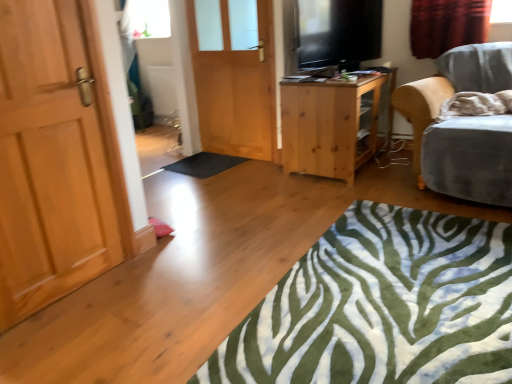
Question: Can you confirm if flat screen tv at upper right is smaller than red velvet curtain at upper right?

Choices:
 (A) yes
 (B) no

Answer: (B)

Question: Can you confirm if flat screen tv at upper right is positioned to the left of red velvet curtain at upper right?

Choices:
 (A) yes
 (B) no

Answer: (A)

Question: Does flat screen tv at upper right have a greater height compared to red velvet curtain at upper right?

Choices:
 (A) yes
 (B) no

Answer: (A)

Question: Considering the relative positions of flat screen tv at upper right and red velvet curtain at upper right in the image provided, is flat screen tv at upper right in front of red velvet curtain at upper right?

Choices:
 (A) no
 (B) yes

Answer: (B)

Question: Is flat screen tv at upper right oriented towards red velvet curtain at upper right?

Choices:
 (A) yes
 (B) no

Answer: (A)

Question: Considering the relative positions of flat screen tv at upper right and red velvet curtain at upper right in the image provided, is flat screen tv at upper right behind red velvet curtain at upper right?

Choices:
 (A) no
 (B) yes

Answer: (A)

Question: From a real-world perspective, is flat screen tv at upper right physically above black rubber mat at center?

Choices:
 (A) no
 (B) yes

Answer: (B)

Question: Could you tell me if flat screen tv at upper right is facing black rubber mat at center?

Choices:
 (A) no
 (B) yes

Answer: (A)

Question: Considering the relative positions of flat screen tv at upper right and black rubber mat at center in the image provided, is flat screen tv at upper right to the right of black rubber mat at center from the viewer's perspective?

Choices:
 (A) yes
 (B) no

Answer: (A)

Question: Is black rubber mat at center surrounded by flat screen tv at upper right?

Choices:
 (A) yes
 (B) no

Answer: (B)

Question: Is flat screen tv at upper right not within black rubber mat at center?

Choices:
 (A) yes
 (B) no

Answer: (A)

Question: Is flat screen tv at upper right at the left side of black rubber mat at center?

Choices:
 (A) no
 (B) yes

Answer: (A)

Question: Is black rubber mat at center further to camera compared to velvet grey chair at right?

Choices:
 (A) yes
 (B) no

Answer: (A)